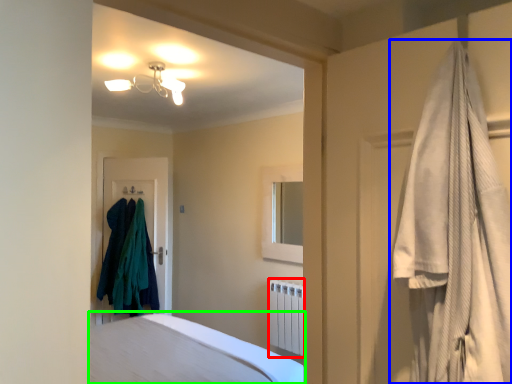
Question: Considering the real-world distances, which object is farthest from radiator (highlighted by a red box)? curtain (highlighted by a blue box) or bed (highlighted by a green box)?

Choices:
 (A) curtain
 (B) bed

Answer: (A)